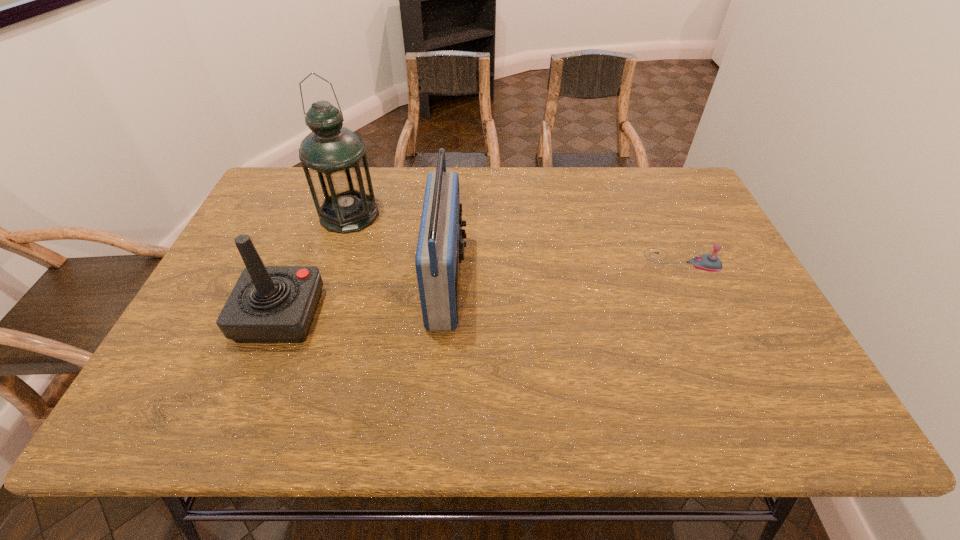
The width and height of the screenshot is (960, 540). Find the location of `oil lamp`. oil lamp is located at coordinates (333, 157).

Identify the location of the tallest object. (333, 157).

Locate an element on the screen. The height and width of the screenshot is (540, 960). radio receiver is located at coordinates (440, 249).

Locate an element on the screen. the left joystick is located at coordinates (269, 304).

Identify the location of the nearer joystick. (269, 304).

Locate an element on the screen. The width and height of the screenshot is (960, 540). the farther joystick is located at coordinates (708, 262).

Where is `the rightmost object`? Image resolution: width=960 pixels, height=540 pixels. the rightmost object is located at coordinates (708, 262).

This screenshot has width=960, height=540. Find the location of `free point located on the back of the farthest object`. free point located on the back of the farthest object is located at coordinates (361, 179).

I want to click on vacant region located on the front panel of the third object from left to right, so click(x=583, y=282).

This screenshot has height=540, width=960. I want to click on vacant space located 0.390m on the front-facing side of the taller joystick, so click(482, 316).